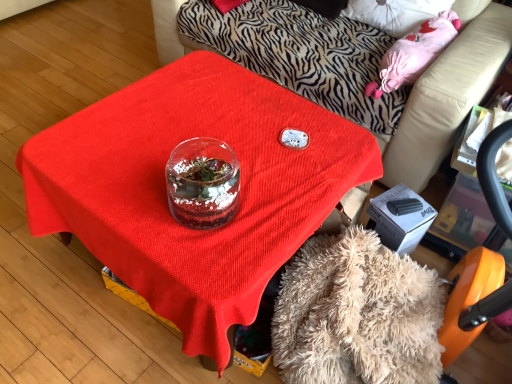
Describe the element at coordinates (166, 191) in the screenshot. I see `transparent glass terrarium at center` at that location.

Where is `transparent glass jar at center`? transparent glass jar at center is located at coordinates (448, 94).

In order to click on fuzzy beige blanket at lower center in this screenshot , I will do `click(357, 314)`.

Considering the positions of objects fuzzy beige blanket at lower center and transparent glass jar at center in the image provided, who is more to the right, fuzzy beige blanket at lower center or transparent glass jar at center?

Positioned to the right is transparent glass jar at center.

How many degrees apart are the facing directions of fuzzy beige blanket at lower center and transparent glass jar at center?

The angular difference between fuzzy beige blanket at lower center and transparent glass jar at center is 89.7 degrees.

From the image's perspective, which is above, fuzzy beige blanket at lower center or transparent glass jar at center?

From the image's view, transparent glass jar at center is above.

Does fuzzy beige blanket at lower center come in front of transparent glass jar at center?

Yes, fuzzy beige blanket at lower center is closer to the camera.

Looking at this image, from a real-world perspective, is transparent glass terrarium at center located beneath fuzzy beige blanket at lower center?

No.

How many degrees apart are the facing directions of transparent glass terrarium at center and fuzzy beige blanket at lower center?

transparent glass terrarium at center and fuzzy beige blanket at lower center are facing 0.239 degrees away from each other.

From the image's perspective, would you say transparent glass terrarium at center is shown under fuzzy beige blanket at lower center?

No, from the image's perspective, transparent glass terrarium at center is not beneath fuzzy beige blanket at lower center.

Is transparent glass terrarium at center positioned with its back to fuzzy beige blanket at lower center?

Yes.

Can you confirm if transparent glass terrarium at center is wider than transparent glass jar at center?

In fact, transparent glass terrarium at center might be narrower than transparent glass jar at center.

Which is less distant, (157,194) or (466,59)?

The point (157,194) is closer to the camera.

Would you say transparent glass terrarium at center contains transparent glass jar at center?

No, transparent glass jar at center is not a part of transparent glass terrarium at center.

Where is `furniture behind the transparent glass terrarium at center`? furniture behind the transparent glass terrarium at center is located at coordinates (448, 94).

Is transparent glass jar at center turned away from fuzzy beige blanket at lower center?

No, transparent glass jar at center is not facing away from fuzzy beige blanket at lower center.

Does transparent glass jar at center lie behind fuzzy beige blanket at lower center?

Yes, transparent glass jar at center is further from the camera.

How different are the orientations of transparent glass jar at center and fuzzy beige blanket at lower center in degrees?

89.7 degrees.

Is transparent glass jar at center completely or partially outside of fuzzy beige blanket at lower center?

transparent glass jar at center is positioned outside fuzzy beige blanket at lower center.

Is fuzzy beige blanket at lower center to the right of transparent glass terrarium at center from the viewer's perspective?

Correct, you'll find fuzzy beige blanket at lower center to the right of transparent glass terrarium at center.

Looking at the image, does fuzzy beige blanket at lower center seem bigger or smaller compared to transparent glass terrarium at center?

Considering their sizes, fuzzy beige blanket at lower center takes up less space than transparent glass terrarium at center.

Choose the correct answer: Is fuzzy beige blanket at lower center inside transparent glass terrarium at center or outside it?

fuzzy beige blanket at lower center exists outside the volume of transparent glass terrarium at center.

Is fuzzy beige blanket at lower center positioned behind transparent glass terrarium at center?

No, fuzzy beige blanket at lower center is closer to the camera.

Which object is thinner, transparent glass jar at center or transparent glass terrarium at center?

transparent glass terrarium at center is thinner.

How many degrees apart are the facing directions of transparent glass jar at center and transparent glass terrarium at center?

transparent glass jar at center and transparent glass terrarium at center are facing 89.9 degrees away from each other.

Find the location of a particular element. furniture located on the right of transparent glass terrarium at center is located at coordinates (448, 94).

Does transparent glass jar at center have a greater height compared to transparent glass terrarium at center?

Indeed, transparent glass jar at center has a greater height compared to transparent glass terrarium at center.

Find the location of a particular element. blanket in front of the transparent glass jar at center is located at coordinates (357, 314).

At what (x,y) coordinates should I click in order to perform the action: click on desk on the left side of fuzzy beige blanket at lower center. Please return your answer as a coordinate pair (x, y). The image size is (512, 384). Looking at the image, I should click on (166, 191).

Which object lies nearer to the anchor point transparent glass terrarium at center, fuzzy beige blanket at lower center or transparent glass jar at center?

fuzzy beige blanket at lower center is positioned closer to the anchor transparent glass terrarium at center.

Based on their spatial positions, is fuzzy beige blanket at lower center or transparent glass terrarium at center further from transparent glass jar at center?

The object further to transparent glass jar at center is transparent glass terrarium at center.

Consider the image. Considering their positions, is transparent glass jar at center positioned closer to transparent glass terrarium at center than fuzzy beige blanket at lower center?

fuzzy beige blanket at lower center.

Which object lies nearer to the anchor point fuzzy beige blanket at lower center, transparent glass terrarium at center or transparent glass jar at center?

transparent glass terrarium at center lies closer to fuzzy beige blanket at lower center than the other object.

From the image, which object appears to be nearer to transparent glass jar at center, transparent glass terrarium at center or fuzzy beige blanket at lower center?

fuzzy beige blanket at lower center is positioned closer to the anchor transparent glass jar at center.

From the image, which object appears to be nearer to fuzzy beige blanket at lower center, transparent glass jar at center or transparent glass terrarium at center?

transparent glass terrarium at center lies closer to fuzzy beige blanket at lower center than the other object.

This screenshot has height=384, width=512. I want to click on desk between transparent glass jar at center and fuzzy beige blanket at lower center from top to bottom, so click(166, 191).